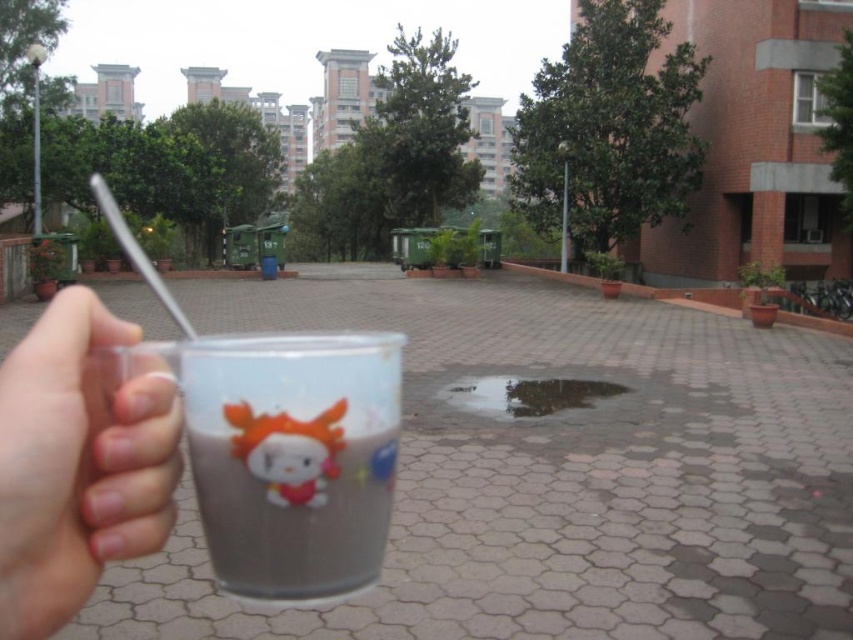
Question: Can you confirm if transparent plastic cup at center is positioned below transparent plastic cup at lower left?

Choices:
 (A) yes
 (B) no

Answer: (A)

Question: Among these objects, which one is farthest from the camera?

Choices:
 (A) matte plastic cup at lower center
 (B) transparent plastic cup at lower left
 (C) transparent plastic cup at center

Answer: (C)

Question: Which point is farther to the camera?

Choices:
 (A) (279, 436)
 (B) (328, 348)
 (C) (468, 380)

Answer: (C)

Question: Where is transparent plastic cup at lower left located in relation to matte plastic cup at lower center in the image?

Choices:
 (A) left
 (B) right

Answer: (A)

Question: Does matte plastic cup at lower center have a lesser width compared to glossy concrete puddle at center?

Choices:
 (A) yes
 (B) no

Answer: (A)

Question: Which point is closer to the camera?

Choices:
 (A) transparent plastic cup at center
 (B) matte plastic cup at lower center
 (C) transparent plastic cup at lower left
 (D) glossy concrete puddle at center

Answer: (C)